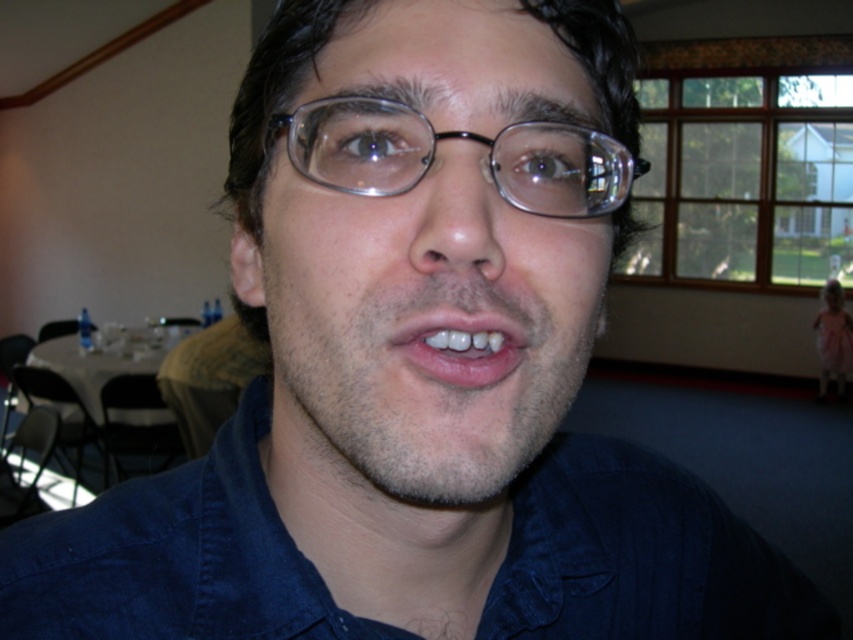
In the scene shown: Which of these two, clear plastic glasses at center or white glossy teeth at center, stands taller?

clear plastic glasses at center

Is clear plastic glasses at center thinner than white glossy teeth at center?

No, clear plastic glasses at center is not thinner than white glossy teeth at center.

The height and width of the screenshot is (640, 853). I want to click on clear plastic glasses at center, so click(x=460, y=138).